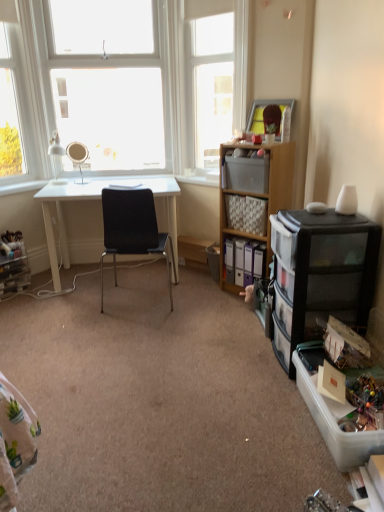
The image size is (384, 512). Identify the location of free space between white glossy desk at center and black mesh chair at center. (88, 304).